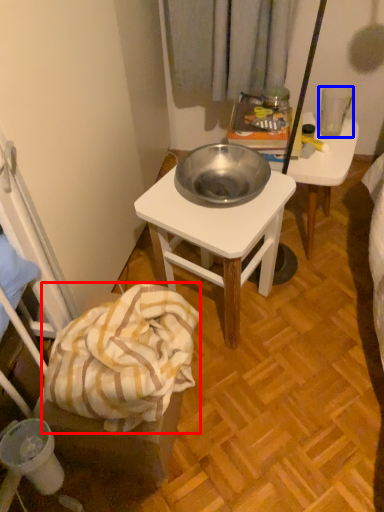
Question: Which point is closer to the camera, blanket (highlighted by a red box) or coffee cup (highlighted by a blue box)?

Choices:
 (A) blanket
 (B) coffee cup

Answer: (A)